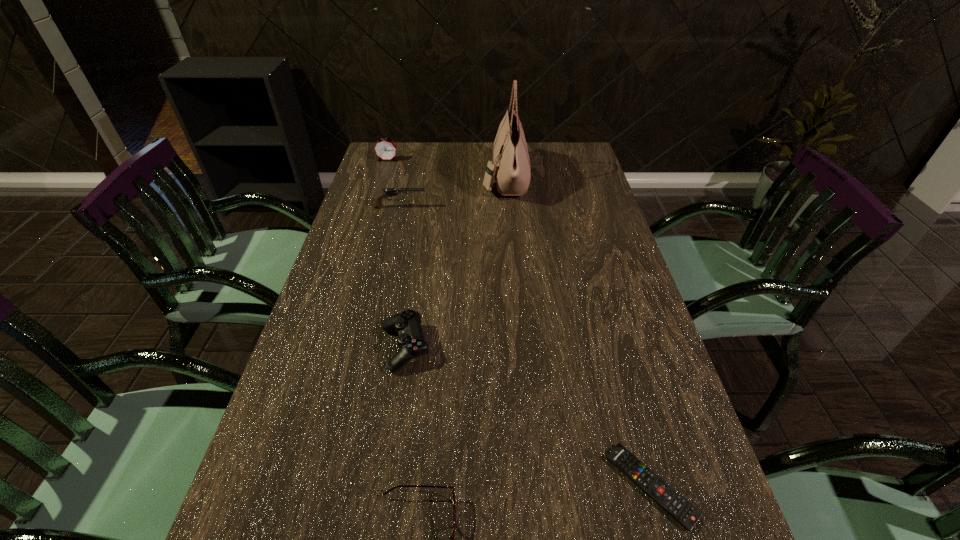
In order to click on handbag in this screenshot , I will do `click(511, 169)`.

Find the location of `the fifth object from left to right`. the fifth object from left to right is located at coordinates (511, 169).

Where is `the second tallest object`? the second tallest object is located at coordinates (385, 149).

You are a GUI agent. You are given a task and a screenshot of the screen. Output one action in this format:
    pyautogui.click(x=<x>, y=<y>)
    Task: Click on the gun
    
    Given the screenshot: What is the action you would take?
    pyautogui.click(x=388, y=192)

Locate an element on the screen. This screenshot has width=960, height=540. control is located at coordinates (407, 324).

Identify the location of remote control. The width and height of the screenshot is (960, 540). (687, 515).

Where is `the shortest object`? the shortest object is located at coordinates (687, 515).

Find the location of `blank space located 0.130m on the side of the tallest object with the attached pouch`. blank space located 0.130m on the side of the tallest object with the attached pouch is located at coordinates (446, 179).

This screenshot has width=960, height=540. Find the location of `vacant position located 0.180m on the side of the tallest object with the attached pouch`. vacant position located 0.180m on the side of the tallest object with the attached pouch is located at coordinates (432, 179).

At what (x,y) coordinates should I click in order to perform the action: click on vacant space located on the side of the tallest object with the attached pouch. Please return your answer as a coordinate pair (x, y). The width and height of the screenshot is (960, 540). Looking at the image, I should click on (371, 179).